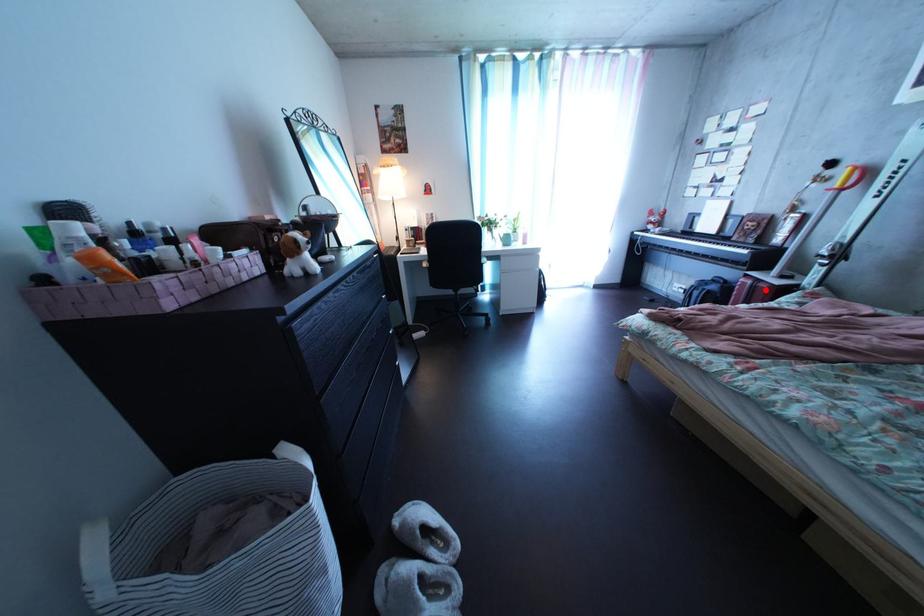
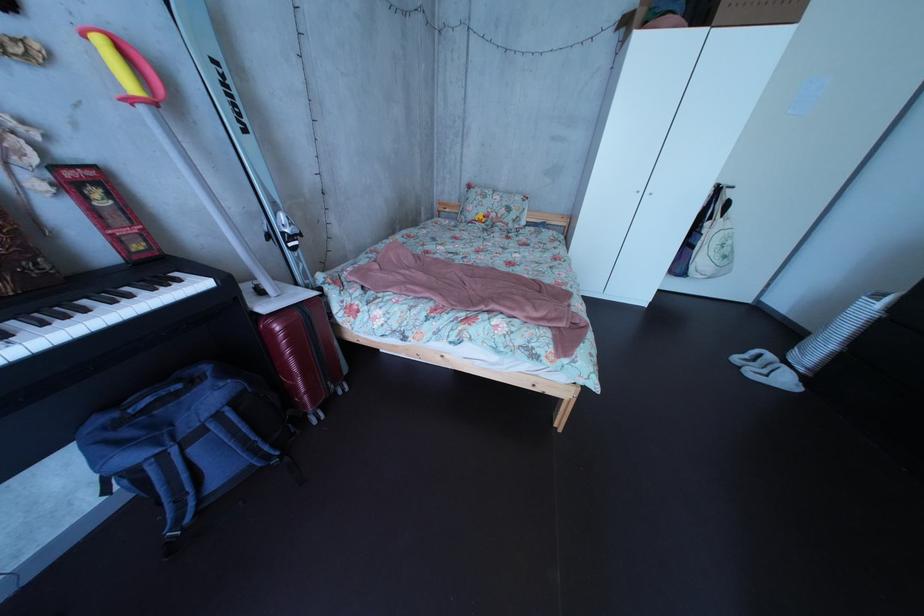
Find the pixel in the second image that matches the highlighted location in the first image.

(311, 322)